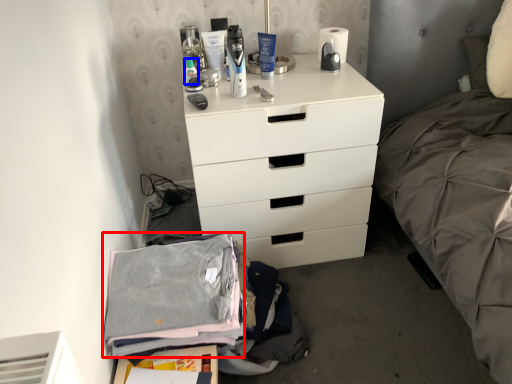
Question: Which object appears farthest to the camera in this image, clothing (highlighted by a red box) or toiletry (highlighted by a blue box)?

Choices:
 (A) clothing
 (B) toiletry

Answer: (B)